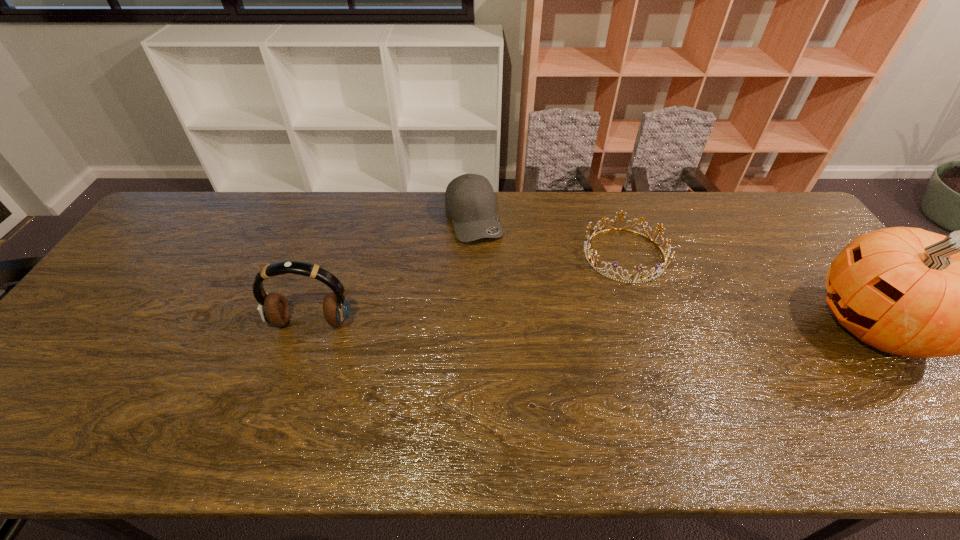
Identify the location of the leftmost object. This screenshot has height=540, width=960. [273, 307].

At what (x,y) coordinates should I click in order to perform the action: click on the third shortest object. Please return your answer as a coordinate pair (x, y). The image size is (960, 540). Looking at the image, I should click on (273, 307).

Find the location of `the second shortest object`. the second shortest object is located at coordinates (470, 202).

The width and height of the screenshot is (960, 540). What are the coordinates of `the third object from right to left` in the screenshot? It's located at 470,202.

Identify the location of tiara. The height and width of the screenshot is (540, 960). (642, 279).

I want to click on the shortest object, so click(x=642, y=279).

This screenshot has height=540, width=960. I want to click on vacant point located 0.050m on the ear cup of the headset, so [302, 350].

I want to click on free space located on the front brim of the baseball cap, so click(x=518, y=340).

This screenshot has height=540, width=960. In order to click on free space located on the front brim of the baseball cap in this screenshot , I will do `click(515, 330)`.

Image resolution: width=960 pixels, height=540 pixels. What are the coordinates of `vacant space situated 0.270m on the front brim of the baseball cap` in the screenshot? It's located at (507, 311).